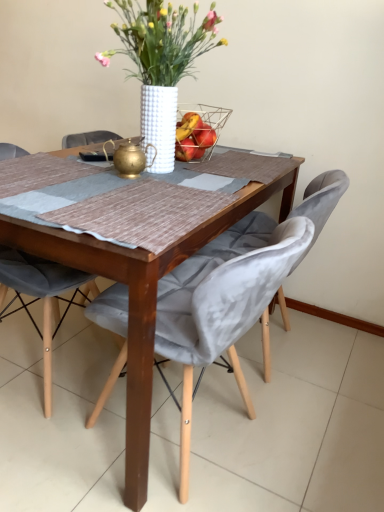
Where is `free space in front of white textured vase at center`? This screenshot has height=512, width=384. free space in front of white textured vase at center is located at coordinates click(x=130, y=204).